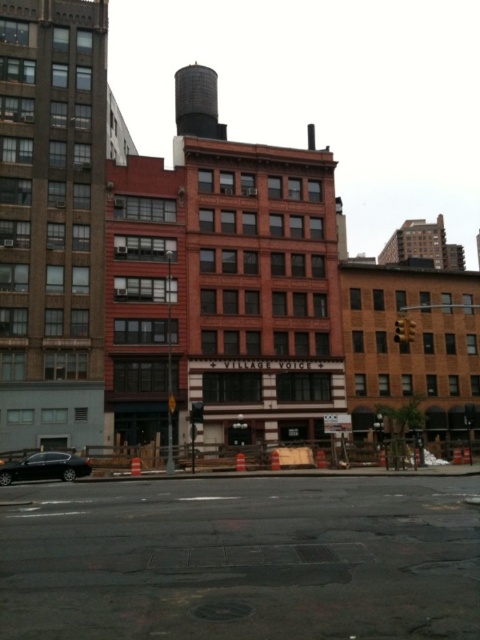
Can you confirm if black asphalt at center is positioned above shiny black sedan at lower left?

Yes.

Does black asphalt at center have a lesser height compared to shiny black sedan at lower left?

No, black asphalt at center is not shorter than shiny black sedan at lower left.

Who is more distant from viewer, (361, 570) or (78, 460)?

The point (78, 460) is more distant.

Identify the location of black asphalt at center. This screenshot has width=480, height=640. (241, 560).

Between black textured water tower at upper center and shiny black sedan at lower left, which one has more height?

black textured water tower at upper center

Between black textured water tower at upper center and shiny black sedan at lower left, which one appears on the right side from the viewer's perspective?

shiny black sedan at lower left

Is point (205, 74) positioned behind point (70, 470)?

Yes.

At what (x,y) coordinates should I click in order to perform the action: click on black textured water tower at upper center. Please return your answer as a coordinate pair (x, y). Looking at the image, I should click on (196, 102).

Can you confirm if black asphalt at center is shorter than black textured water tower at upper center?

Correct, black asphalt at center is not as tall as black textured water tower at upper center.

Who is more distant from viewer, (83, 593) or (206, 92)?

Positioned behind is point (206, 92).

Which is in front, point (330, 500) or point (175, 81)?

Point (330, 500)

You are a GUI agent. You are given a task and a screenshot of the screen. Output one action in this format:
    pyautogui.click(x=<x>, y=<y>)
    Task: Click on the black asphalt at center
    This screenshot has width=480, height=640.
    Given the screenshot: What is the action you would take?
    pyautogui.click(x=241, y=560)